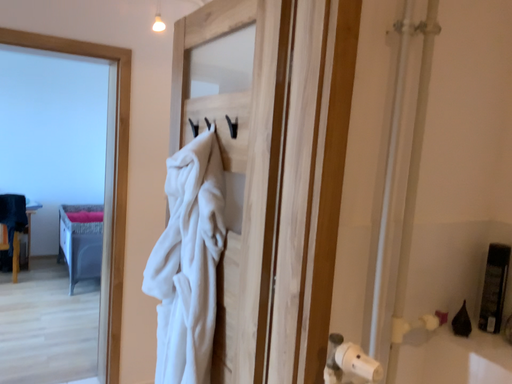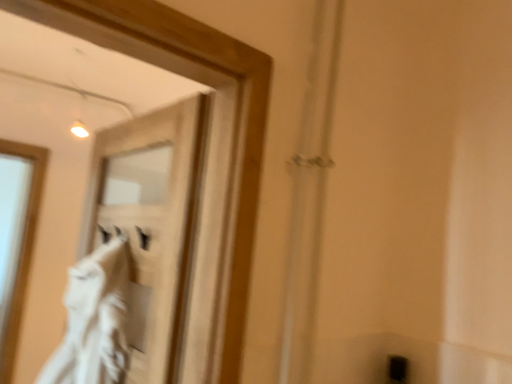
Question: Which way did the camera rotate in the video?

Choices:
 (A) rotated upward
 (B) rotated downward

Answer: (A)